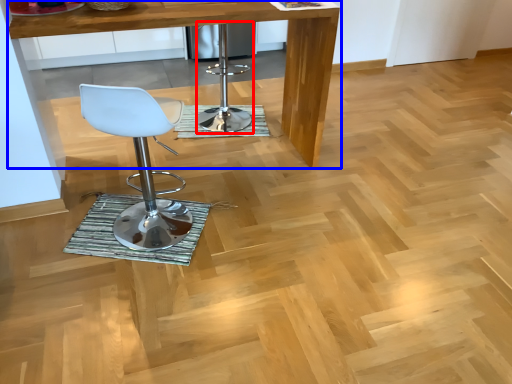
Question: Which point is further to the camera, bar stool (highlighted by a red box) or table (highlighted by a blue box)?

Choices:
 (A) bar stool
 (B) table

Answer: (A)